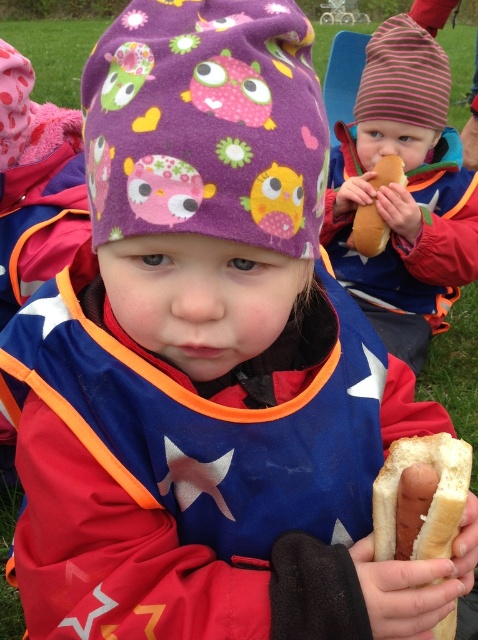
Consider the image. You are standing in the picnic area and want to place two items at the specified coordinates. The first item is at point (460, 492) and the second at point (370, 250). Which point is closer to you?

Point (460, 492) is closer to the viewer than point (370, 250).

You are a photographer trying to capture a closeup of the striped knit hat at upper right and the white soft hot dog at center. Which object should you zoom in on first to ensure both fit in the frame?

You should zoom in on the striped knit hat at upper right first because it is wider than the white soft hot dog at center, so adjusting for its width will ensure both fit in the frame.

Based on the scene description, where is the striped knit hat at upper right located in the image?

The striped knit hat at upper right is located at point 0.302 on the x axis and 0.845 on the y axis.